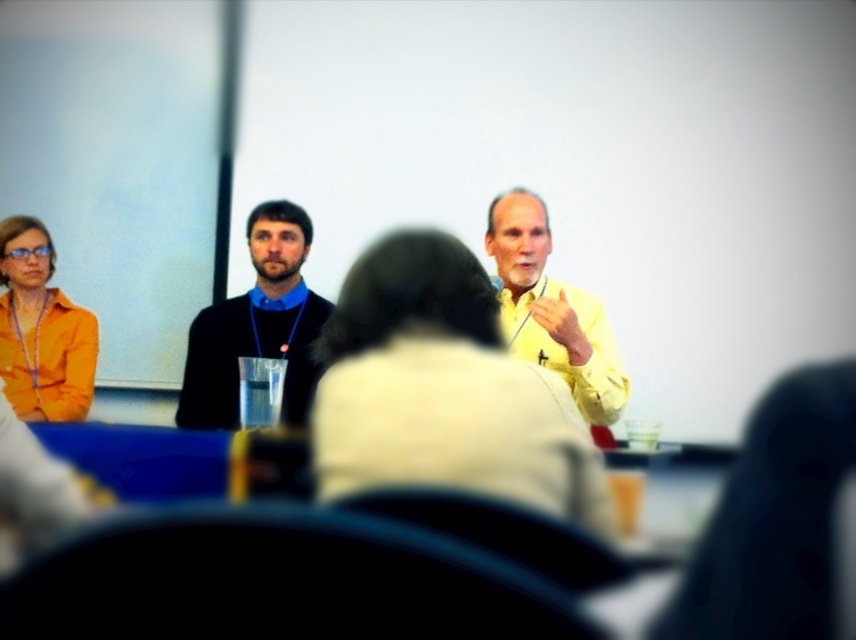
Is black matte sweater at center wider than yellow matte shirt at center?

Yes.

Locate an element on the screen. The image size is (856, 640). black matte sweater at center is located at coordinates (x=257, y=326).

Between point (299, 339) and point (580, 384), which one is positioned in front?

Point (580, 384)

Locate an element on the screen. This screenshot has height=640, width=856. black matte sweater at center is located at coordinates (257, 326).

Can you confirm if black matte sweater at center is positioned to the left of orange matte shirt at left?

Incorrect, black matte sweater at center is not on the left side of orange matte shirt at left.

Can you confirm if black matte sweater at center is thinner than orange matte shirt at left?

No, black matte sweater at center is not thinner than orange matte shirt at left.

Between point (269, 264) and point (39, 356), which one is positioned behind?

Positioned behind is point (39, 356).

Where is `black matte sweater at center`? The height and width of the screenshot is (640, 856). black matte sweater at center is located at coordinates (257, 326).

Is yellow matte shirt at center positioned at the back of orange matte shirt at left?

That is False.

Based on the photo, does yellow matte shirt at center appear over orange matte shirt at left?

Indeed, yellow matte shirt at center is positioned over orange matte shirt at left.

Measure the distance between point (x=535, y=216) and camera.

Point (x=535, y=216) and camera are 2.37 meters apart from each other.

Locate an element on the screen. This screenshot has width=856, height=640. yellow matte shirt at center is located at coordinates (551, 308).